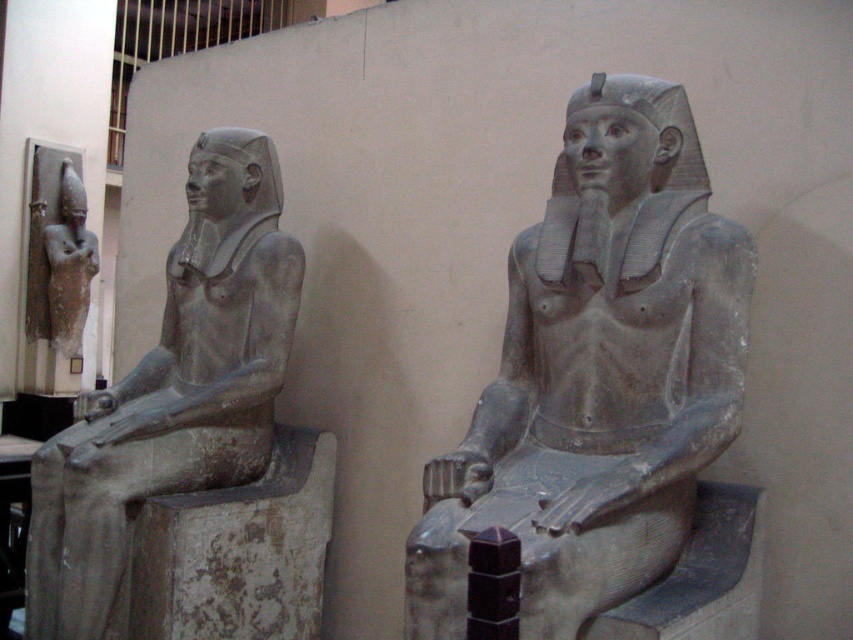
Question: Does gray stone statue at center appear on the left side of gray stone statue at left?

Choices:
 (A) yes
 (B) no

Answer: (B)

Question: Among these objects, which one is farthest from the camera?

Choices:
 (A) gray stone statue at left
 (B) gray stone statue at center

Answer: (A)

Question: Which of the following is the farthest from the observer?

Choices:
 (A) (70, 604)
 (B) (630, 104)

Answer: (A)

Question: Does gray stone statue at center appear on the right side of gray stone statue at left?

Choices:
 (A) yes
 (B) no

Answer: (A)

Question: Is gray stone statue at center above gray stone statue at left?

Choices:
 (A) no
 (B) yes

Answer: (B)